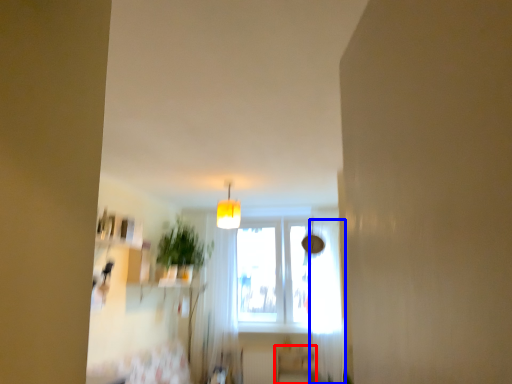
Question: Among these objects, which one is farthest to the camera, furniture (highlighted by a red box) or curtain (highlighted by a blue box)?

Choices:
 (A) furniture
 (B) curtain

Answer: (A)